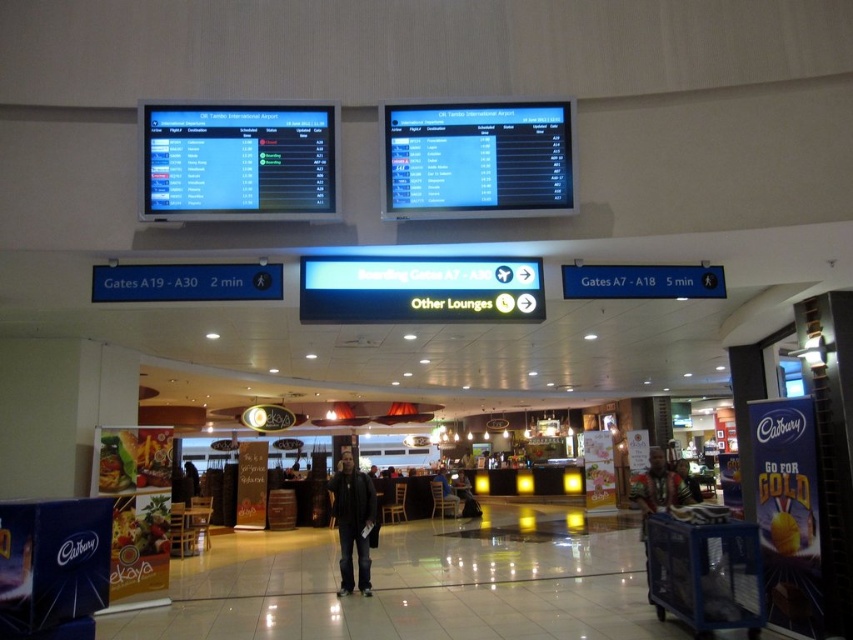
You are an airport security officer and you see a dark gray jacket at center and a wooden tribal mask at center on the Xray machine. Which object is smaller in size?

The dark gray jacket at center is smaller in size compared to the wooden tribal mask at center.

You are a traveler carrying a 18 inches wide backpack and you see the dark gray jacket at center and the wooden tribal mask at center. Which object can you place your backpack next to without it overlapping?

The dark gray jacket at center has a lesser width compared to wooden tribal mask at center, so the backpack can be placed next to the dark gray jacket at center since it is narrower and there might be more space available.